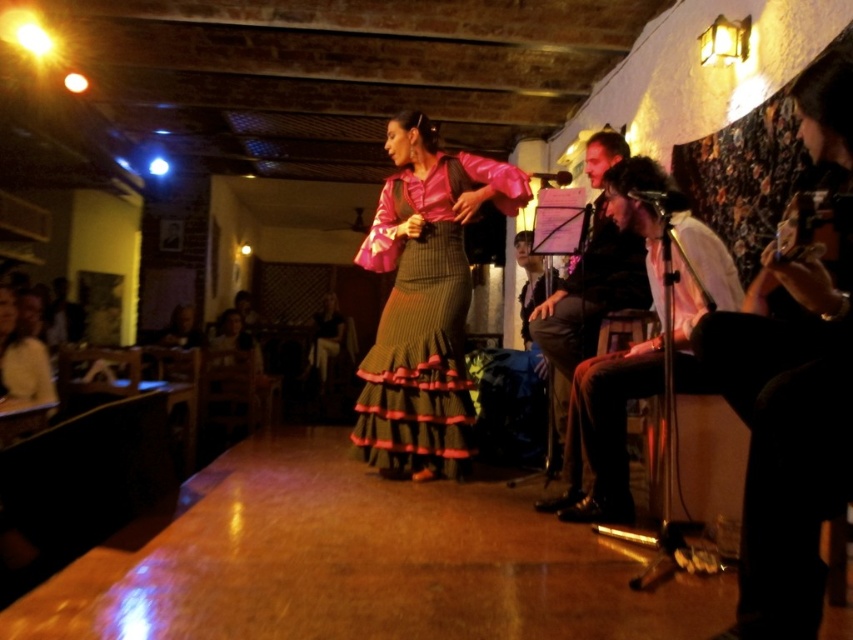
You are a photographer at the flamenco venue. You want to capture a photo of the shiny black guitar at right and the white shirt at right. Based on their positions, which object is closer to the camera?

The shiny black guitar at right is positioned over the white shirt at right, so it is closer to the camera.

You are a photographer at the flamenco venue and need to position a camera to capture both the dark brown leather jacket at upper right and the smooth black jacket at center. Which jacket should you place on the left side of your frame to ensure both are visible?

To ensure both the dark brown leather jacket at upper right and the smooth black jacket at center are visible, position the smooth black jacket at center on the left side of your frame since the dark brown leather jacket at upper right is located to its right.

You are a photographer standing at the entrance of the flamenco venue. You want to capture a closeup shot of the dark brown leather jacket at upper right without moving closer than 3 meters. Can you do it?

The dark brown leather jacket at upper right is 2.99 meters from viewer, so yes, you can capture a closeup shot without moving closer than 3 meters since it is within the desired distance.